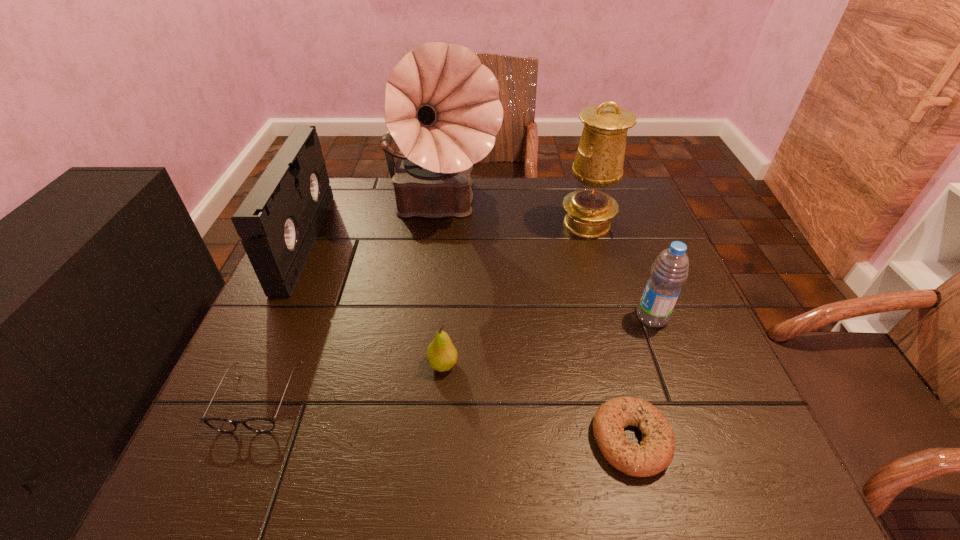
Identify the location of free spot that satisfies the following two spatial constraints: 1. on the back side of the pear; 2. on the side of the videotape with visible spindles. (452, 242).